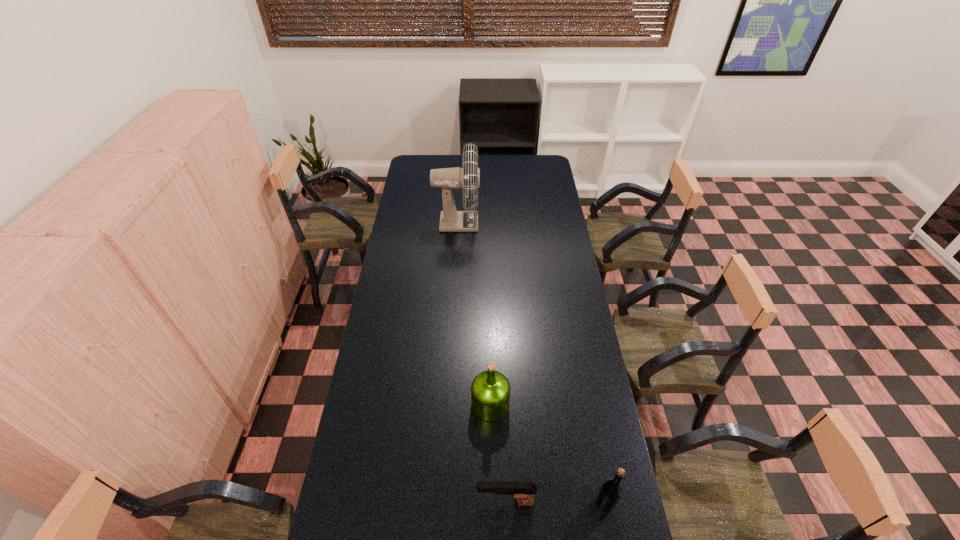
Identify the location of vacant position located 0.290m at the barrel of the pistol. (381, 502).

Identify the location of object present at the right edge. (610, 492).

Locate an element on the screen. The image size is (960, 540). vacant position at the far edge of the desktop is located at coordinates (494, 156).

The image size is (960, 540). Identify the location of vacant space at the left edge. (327, 539).

Identify the location of vacant space at the right edge of the desktop. (583, 345).

At what (x,y) coordinates should I click in order to perform the action: click on vacant space at the far left corner of the desktop. Please return your answer as a coordinate pair (x, y). The height and width of the screenshot is (540, 960). Looking at the image, I should click on (411, 176).

Find the location of a particular element. The height and width of the screenshot is (540, 960). free space between the shortest object and the beer bottle is located at coordinates [x=555, y=502].

This screenshot has height=540, width=960. I want to click on vacant area that lies between the rightmost object and the third nearest object, so click(547, 454).

You are a GUI agent. You are given a task and a screenshot of the screen. Output one action in this format:
    pyautogui.click(x=<x>, y=<y>)
    Task: Click on the blank region between the olive oil and the fan
    This screenshot has width=960, height=540.
    Given the screenshot: What is the action you would take?
    pyautogui.click(x=473, y=313)

In order to click on free space that is in between the shortest object and the tallest object in this screenshot , I will do `click(481, 362)`.